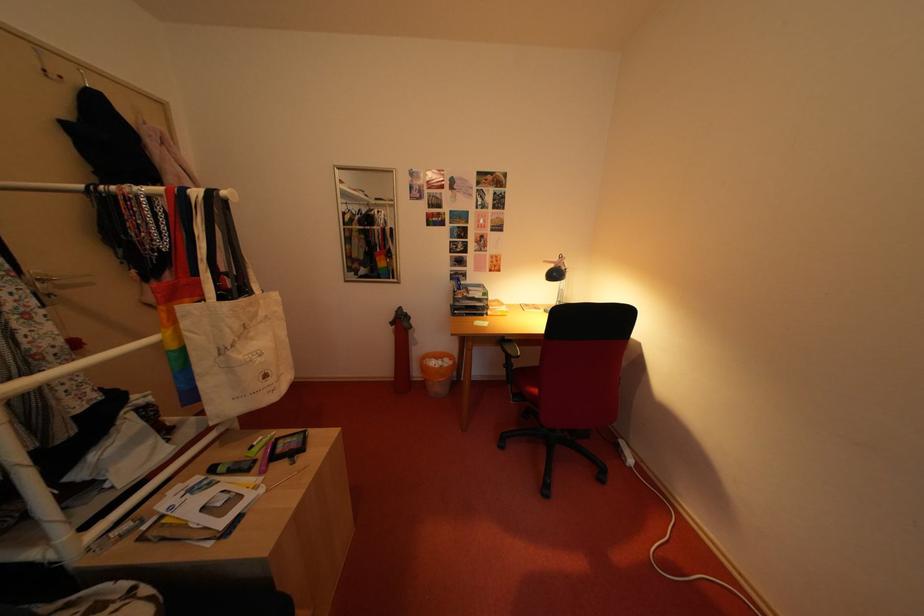
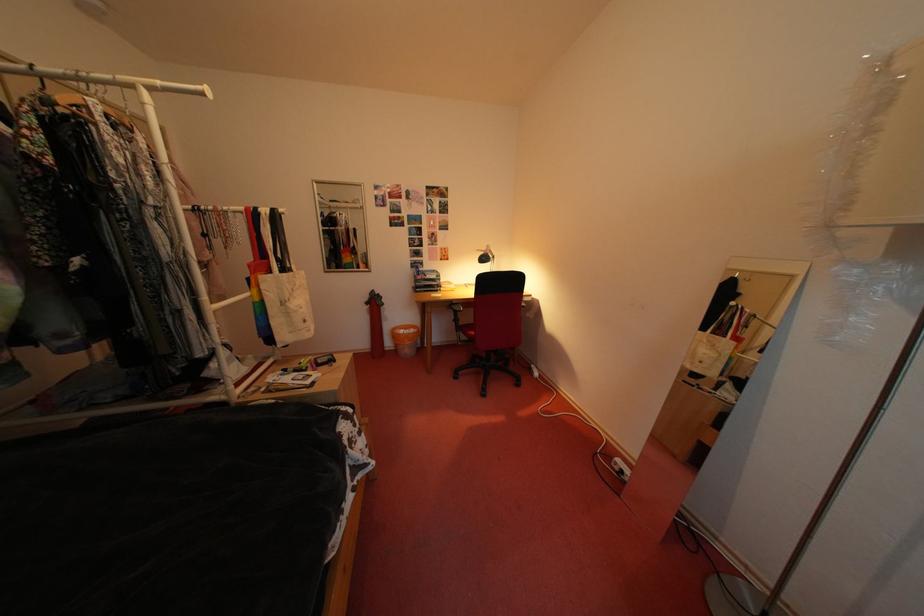
Locate, in the second image, the point that corresponds to (193,354) in the first image.

(273, 306)